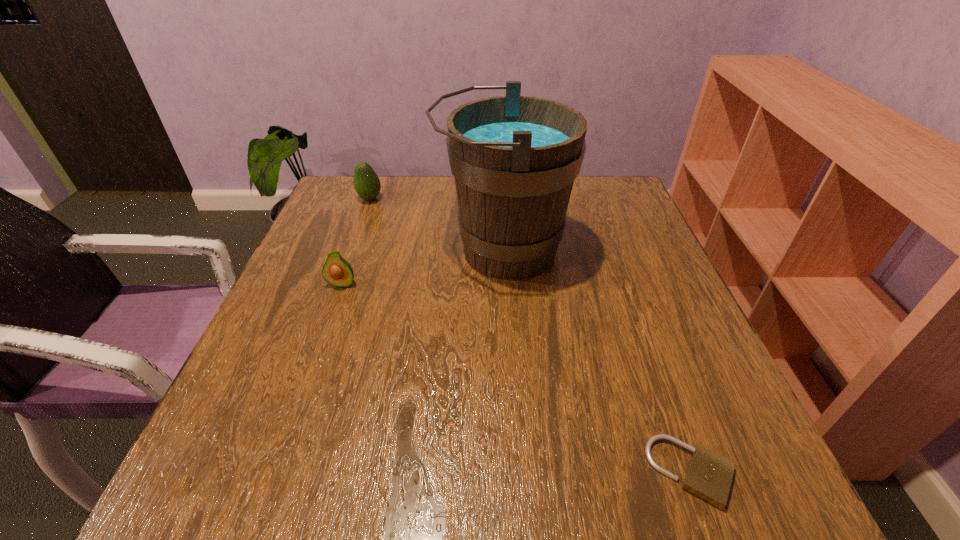
The height and width of the screenshot is (540, 960). In order to click on blank region between the wine bucket and the farthest object in this screenshot , I will do `click(436, 225)`.

The width and height of the screenshot is (960, 540). Identify the location of free space between the nearest object and the farthest object. (531, 335).

Where is `free spot between the nearer avocado and the shortest object`? The image size is (960, 540). free spot between the nearer avocado and the shortest object is located at coordinates (516, 378).

The height and width of the screenshot is (540, 960). What are the coordinates of `unoccupied position between the tallest object and the nearer avocado` in the screenshot? It's located at (x=422, y=267).

Identify the location of the second closest object to the tallest object. (367, 185).

Image resolution: width=960 pixels, height=540 pixels. Find the location of `the third closest object to the farther avocado`. the third closest object to the farther avocado is located at coordinates (709, 475).

The image size is (960, 540). What are the coordinates of `vacant area that satisfies the following two spatial constraints: 1. on the cut side of the padlock; 2. on the right side of the nearer avocado` in the screenshot? It's located at (276, 472).

You are a GUI agent. You are given a task and a screenshot of the screen. Output one action in this format:
    pyautogui.click(x=<x>, y=<y>)
    Task: Click on the free space that satisfies the following two spatial constraints: 1. with a handle on the side of the wine bucket; 2. on the right side of the shortest object
    The height and width of the screenshot is (540, 960).
    Given the screenshot: What is the action you would take?
    pyautogui.click(x=516, y=472)

Where is `vacant point that satisfies the following two spatial constraints: 1. on the cut side of the nearer avocado; 2. on the right side of the rightmost object`? The width and height of the screenshot is (960, 540). vacant point that satisfies the following two spatial constraints: 1. on the cut side of the nearer avocado; 2. on the right side of the rightmost object is located at coordinates (276, 472).

Locate an element on the screen. The image size is (960, 540). free point that satisfies the following two spatial constraints: 1. with a handle on the side of the third object from left to right; 2. on the right side of the nearest object is located at coordinates (516, 472).